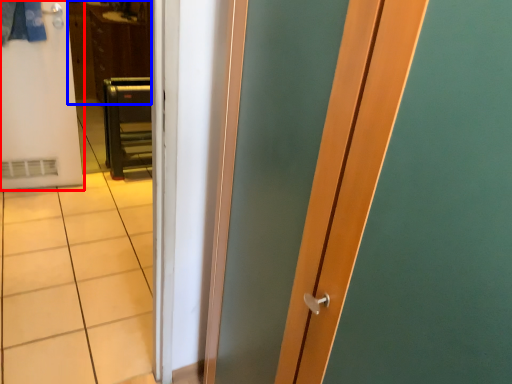
Question: Which object appears closest to the camera in this image, door (highlighted by a red box) or dresser (highlighted by a blue box)?

Choices:
 (A) door
 (B) dresser

Answer: (A)